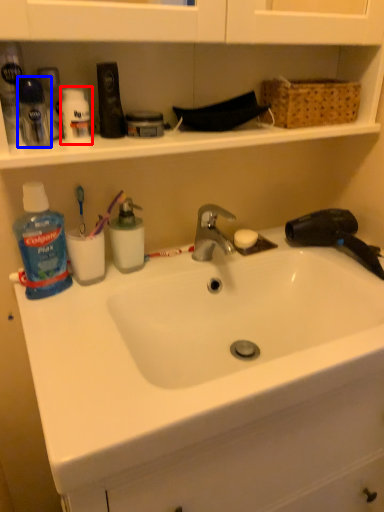
Question: Which of the following is the closest to the observer, toiletry (highlighted by a red box) or toiletry (highlighted by a blue box)?

Choices:
 (A) toiletry
 (B) toiletry

Answer: (B)